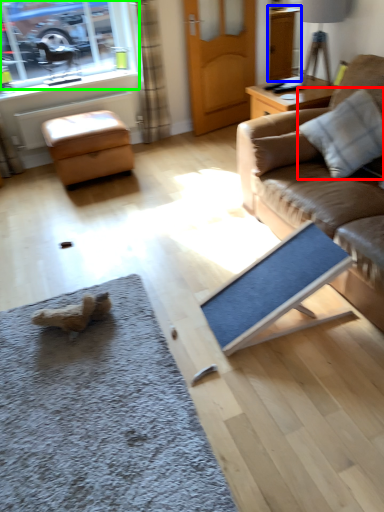
Question: Which object is positioned closest to pillow (highlighted by a red box)? Select from cabinetry (highlighted by a blue box) and window (highlighted by a green box).

Choices:
 (A) cabinetry
 (B) window

Answer: (A)